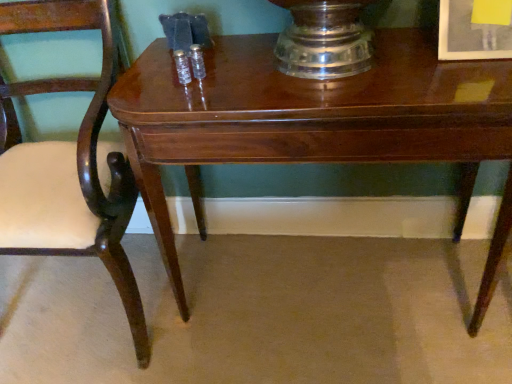
I want to click on free space to the left of matte white picture frame at upper right, so click(399, 56).